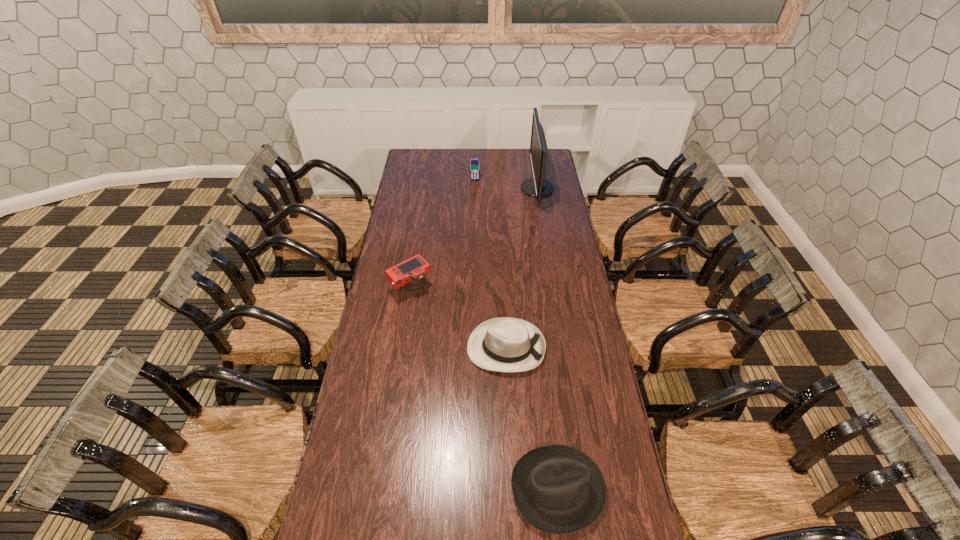
The height and width of the screenshot is (540, 960). Identify the location of vacant area situated 0.380m on the right of the camera. (519, 288).

Find the location of a particular element. free region located 0.390m on the back of the nearer fedora is located at coordinates (541, 348).

Where is `free space located on the front-facing side of the farther fedora`? This screenshot has height=540, width=960. free space located on the front-facing side of the farther fedora is located at coordinates (398, 348).

This screenshot has height=540, width=960. Find the location of `vacant area located 0.080m on the front-facing side of the farther fedora`. vacant area located 0.080m on the front-facing side of the farther fedora is located at coordinates (446, 348).

Identify the location of blank space located 0.060m on the front-facing side of the farther fedora. This screenshot has width=960, height=540. (451, 348).

You are a GUI agent. You are given a task and a screenshot of the screen. Output one action in this format:
    pyautogui.click(x=<x>, y=<y>)
    Task: Click on the object positioned at the far edge
    The height and width of the screenshot is (540, 960).
    Given the screenshot: What is the action you would take?
    pyautogui.click(x=538, y=186)

Find the location of a particular element. object at the left edge is located at coordinates (410, 273).

Where is `monitor at the right edge`? The height and width of the screenshot is (540, 960). monitor at the right edge is located at coordinates (538, 186).

Where is `fedora present at the right edge`? This screenshot has height=540, width=960. fedora present at the right edge is located at coordinates (557, 489).

Where is `object positioned at the far right corner`? The image size is (960, 540). object positioned at the far right corner is located at coordinates (538, 186).